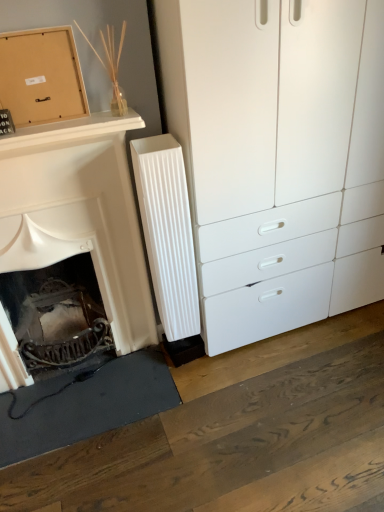
Identify the location of white plastic chest of drawers at right. 278,157.

Describe the element at coordinates (41, 76) in the screenshot. This screenshot has height=512, width=384. I see `matte cardboard box at upper left` at that location.

Image resolution: width=384 pixels, height=512 pixels. What do you see at coordinates (167, 232) in the screenshot?
I see `white ribbed radiator at center` at bounding box center [167, 232].

At what (x,y) coordinates should I click in order to perform the action: click on white plastic chest of drawers at right. Please return your answer as a coordinate pair (x, y). Looking at the image, I should click on (278, 157).

From the picture: Which object is further away from the camera taking this photo, matte cardboard box at upper left or white ribbed radiator at center?

white ribbed radiator at center is further away from the camera.

Is matte cardboard box at upper left thinner than white ribbed radiator at center?

Yes.

Does point (7, 81) appear closer or farther from the camera than point (149, 206)?

Point (7, 81) is positioned closer to the camera compared to point (149, 206).

In the scene shown: Can you tell me how much matte cardboard box at upper left and white ribbed radiator at center differ in facing direction?

The angular difference between matte cardboard box at upper left and white ribbed radiator at center is 2.49 degrees.

From the image's perspective, does white matte fireplace at left appear lower than white ribbed radiator at center?

Actually, white matte fireplace at left appears above white ribbed radiator at center in the image.

Does point (3, 354) lie behind point (188, 215)?

That is True.

Which is behind, white matte fireplace at left or white ribbed radiator at center?

white ribbed radiator at center is more distant.

Is white matte fireplace at left oriented away from white ribbed radiator at center?

That's not correct — white matte fireplace at left is not looking away from white ribbed radiator at center.

Can you tell me how much white plastic chest of drawers at right and white matte fireplace at left differ in facing direction?

The facing directions of white plastic chest of drawers at right and white matte fireplace at left are 0.781 degrees apart.

Does white plastic chest of drawers at right have a lesser width compared to white matte fireplace at left?

In fact, white plastic chest of drawers at right might be wider than white matte fireplace at left.

Is white plastic chest of drawers at right positioned far away from white matte fireplace at left?

No.

From the image's perspective, is matte cardboard box at upper left above or below white plastic chest of drawers at right?

matte cardboard box at upper left is above white plastic chest of drawers at right.

From a real-world perspective, is matte cardboard box at upper left positioned above or below white plastic chest of drawers at right?

In terms of real-world spatial position, matte cardboard box at upper left is above white plastic chest of drawers at right.

Is matte cardboard box at upper left aimed at white plastic chest of drawers at right?

No, matte cardboard box at upper left does not turn towards white plastic chest of drawers at right.

Is matte cardboard box at upper left smaller than white plastic chest of drawers at right?

Yes.

At what (x,y) coordinates should I click in order to perform the action: click on cardboard box above the white matte fireplace at left (from the image's perspective). Please return your answer as a coordinate pair (x, y). Looking at the image, I should click on (x=41, y=76).

Considering the sizes of matte cardboard box at upper left and white matte fireplace at left in the image, is matte cardboard box at upper left wider or thinner than white matte fireplace at left?

Clearly, matte cardboard box at upper left has less width compared to white matte fireplace at left.

Does matte cardboard box at upper left have a greater height compared to white matte fireplace at left?

In fact, matte cardboard box at upper left may be shorter than white matte fireplace at left.

Is matte cardboard box at upper left located outside white matte fireplace at left?

matte cardboard box at upper left lies outside white matte fireplace at left's area.

In order to click on radiator that is below the white plastic chest of drawers at right (from the image's perspective) in this screenshot , I will do `click(167, 232)`.

Which is in front, point (300, 65) or point (172, 214)?

The point (300, 65) is closer.

Would you consider white plastic chest of drawers at right to be distant from white ribbed radiator at center?

No, white plastic chest of drawers at right is in close proximity to white ribbed radiator at center.

From a real-world perspective, is white plastic chest of drawers at right positioned above or below white ribbed radiator at center?

white plastic chest of drawers at right is above white ribbed radiator at center.

Is white ribbed radiator at center oriented towards matte cardboard box at upper left?

No, white ribbed radiator at center is not facing towards matte cardboard box at upper left.

Which object is positioned more to the right, white ribbed radiator at center or matte cardboard box at upper left?

white ribbed radiator at center is more to the right.

From a real-world perspective, is white ribbed radiator at center beneath matte cardboard box at upper left?

Yes, from a real-world perspective, white ribbed radiator at center is beneath matte cardboard box at upper left.

I want to click on radiator that is on the right side of matte cardboard box at upper left, so click(167, 232).

Find the location of a particular element. This screenshot has height=512, width=384. fireplace above the white ribbed radiator at center (from the image's perspective) is located at coordinates (79, 213).

Considering their positions, is matte cardboard box at upper left positioned further to white plastic chest of drawers at right than white ribbed radiator at center?

matte cardboard box at upper left is positioned further to the anchor white plastic chest of drawers at right.

Considering their positions, is matte cardboard box at upper left positioned closer to white ribbed radiator at center than white plastic chest of drawers at right?

white plastic chest of drawers at right is positioned closer to the anchor white ribbed radiator at center.

Considering their positions, is white plastic chest of drawers at right positioned further to matte cardboard box at upper left than white matte fireplace at left?

white plastic chest of drawers at right is positioned further to the anchor matte cardboard box at upper left.

Which object lies nearer to the anchor point matte cardboard box at upper left, white matte fireplace at left or white plastic chest of drawers at right?

white matte fireplace at left is positioned closer to the anchor matte cardboard box at upper left.

Estimate the real-world distances between objects in this image. Which object is closer to white plastic chest of drawers at right, white matte fireplace at left or matte cardboard box at upper left?

white matte fireplace at left lies closer to white plastic chest of drawers at right than the other object.

Estimate the real-world distances between objects in this image. Which object is further from white matte fireplace at left, white ribbed radiator at center or white plastic chest of drawers at right?

Among the two, white plastic chest of drawers at right is located further to white matte fireplace at left.

Which object lies nearer to the anchor point white matte fireplace at left, matte cardboard box at upper left or white ribbed radiator at center?

white ribbed radiator at center is closer to white matte fireplace at left.

Based on their spatial positions, is matte cardboard box at upper left or white plastic chest of drawers at right closer to white matte fireplace at left?

matte cardboard box at upper left.

I want to click on fireplace that lies between matte cardboard box at upper left and white ribbed radiator at center from top to bottom, so click(79, 213).

The width and height of the screenshot is (384, 512). Identify the location of radiator located between matte cardboard box at upper left and white plastic chest of drawers at right in the left-right direction. click(x=167, y=232).

Image resolution: width=384 pixels, height=512 pixels. I want to click on radiator between white matte fireplace at left and white plastic chest of drawers at right in the horizontal direction, so click(167, 232).

I want to click on cardboard box between white matte fireplace at left and white plastic chest of drawers at right in the horizontal direction, so click(x=41, y=76).